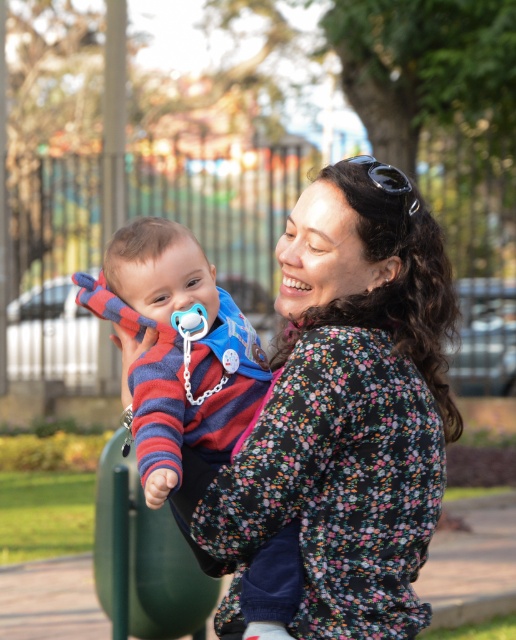
In the scene shown: You are a photographer trying to capture a closeup of the floral print blouse at center and the striped fabric baby at center. Since the camera can only focus on one subject at a time, which one will be in focus if you adjust the focus to the lower part of the frame?

The floral print blouse at center will be in focus because it is located below the striped fabric baby at center, so focusing on the lower part of the frame will capture it clearly.

The woman is wearing a black floral jacket and a floral print blouse at center. How far apart are the two floral items she is wearing?

The two floral items she is wearing, the black floral jacket and the floral print blouse at center, are 4.01 meters apart.

In the scene shown: You are a photographer trying to capture a candid shot of the baby. You notice two points marked in the scene. The first point is at coordinate point (439, 339) and the second is at point (131, 220). Which point is closer to the camera based on their positions?

Point (439, 339) is in front of point (131, 220), so it is closer to the camera.